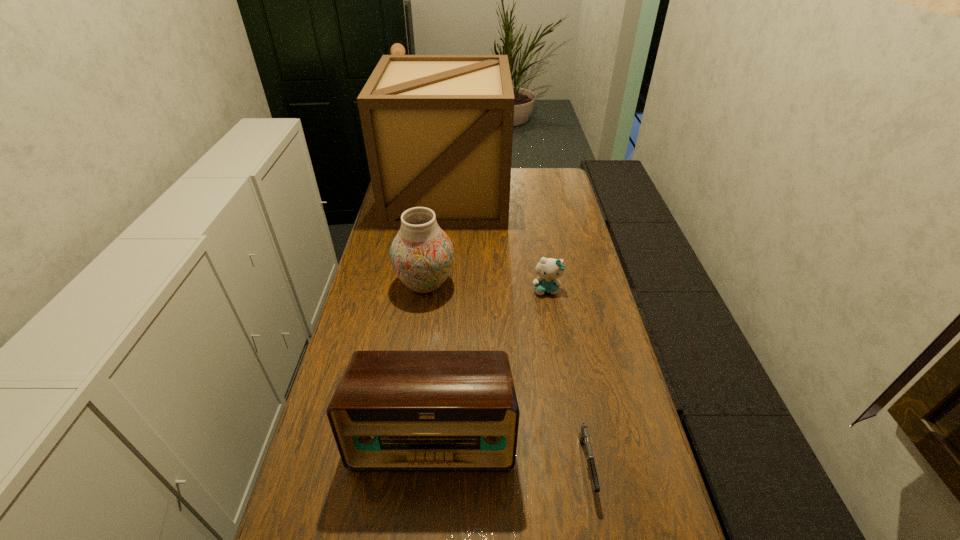
Locate an element on the screen. Image resolution: width=960 pixels, height=540 pixels. the farthest object is located at coordinates (438, 129).

Locate an element on the screen. the tallest object is located at coordinates (438, 129).

Locate an element on the screen. The image size is (960, 540). vase is located at coordinates (421, 254).

Locate an element on the screen. radio receiver is located at coordinates (392, 410).

The height and width of the screenshot is (540, 960). I want to click on kitten, so click(548, 269).

What are the coordinates of `the shortest object` in the screenshot? It's located at 584,436.

This screenshot has height=540, width=960. Identify the location of vacant space located on the reinforced sides of the farthest object. (441, 255).

Locate an element on the screen. vacant area located on the back of the vase is located at coordinates (436, 208).

Locate an element on the screen. This screenshot has height=540, width=960. free space located 0.070m on the front-facing side of the radio receiver is located at coordinates (427, 504).

Locate an element on the screen. This screenshot has width=960, height=540. vacant region located 0.140m on the face of the fourth tallest object is located at coordinates (553, 329).